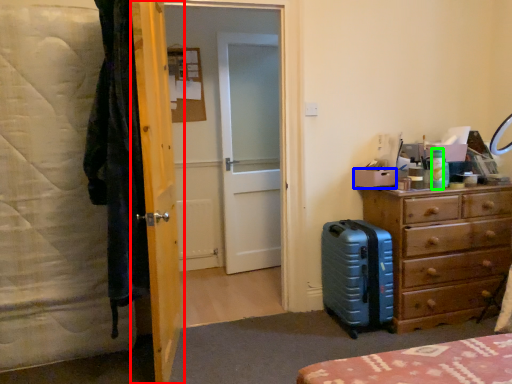
Question: Which object is the farthest from door (highlighted by a red box)? Choose among these: box (highlighted by a blue box) or bottle (highlighted by a green box).

Choices:
 (A) box
 (B) bottle

Answer: (B)